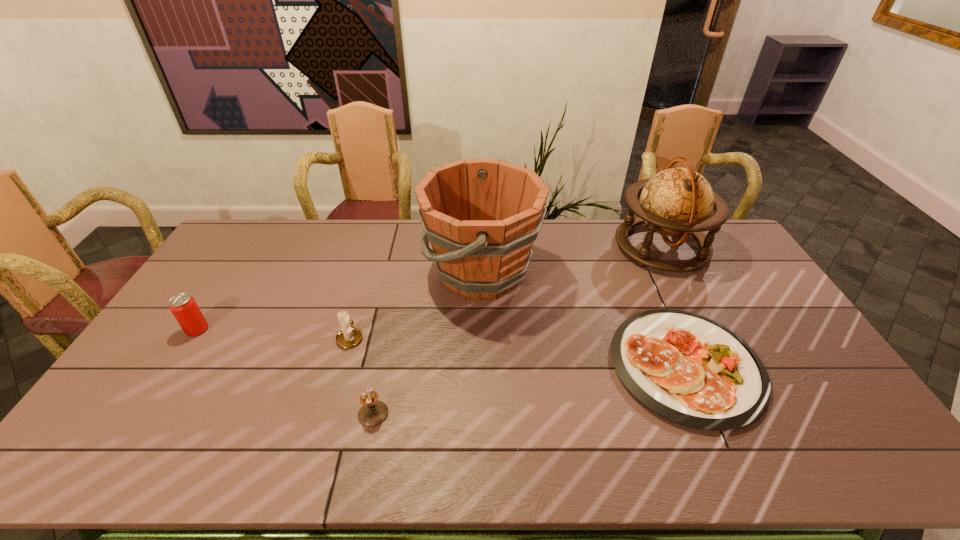
Identify the location of vacant area that lies between the nearer candle holder and the can. The width and height of the screenshot is (960, 540). (285, 372).

Find the location of `vacant point located between the left candle holder and the third object from left to right`. vacant point located between the left candle holder and the third object from left to right is located at coordinates (362, 375).

This screenshot has width=960, height=540. In order to click on unoccupied position between the globe and the shortest object in this screenshot , I will do `click(673, 306)`.

This screenshot has height=540, width=960. Find the location of `vacant space in between the fourth object from left to right and the globe`. vacant space in between the fourth object from left to right and the globe is located at coordinates (571, 260).

Locate an element on the screen. The image size is (960, 540). unoccupied position between the leftmost object and the globe is located at coordinates (429, 288).

Find the location of a particular element. The height and width of the screenshot is (540, 960). free point between the bucket and the globe is located at coordinates (571, 260).

At what (x,y) coordinates should I click in order to perform the action: click on free space that is in between the bucket and the third object from left to right. Please return your answer as a coordinate pair (x, y). The image size is (960, 540). Looking at the image, I should click on pos(427,343).

At what (x,y) coordinates should I click in order to perform the action: click on unoccupied area between the shortest object and the third object from right to left. Please return your answer as a coordinate pair (x, y). The height and width of the screenshot is (540, 960). Looking at the image, I should click on (584, 319).

You are a GUI agent. You are given a task and a screenshot of the screen. Output one action in this format:
    pyautogui.click(x=<x>, y=<y>)
    Task: Click on the vacant area that lies between the shortest object and the farther candle holder
    The image size is (960, 540).
    Given the screenshot: What is the action you would take?
    pyautogui.click(x=517, y=352)

You are a GUI agent. You are given a task and a screenshot of the screen. Output one action in this format:
    pyautogui.click(x=<x>, y=<y>)
    Task: Click on the object that is the third nearest to the shortest object
    The height and width of the screenshot is (540, 960).
    Given the screenshot: What is the action you would take?
    pyautogui.click(x=373, y=412)